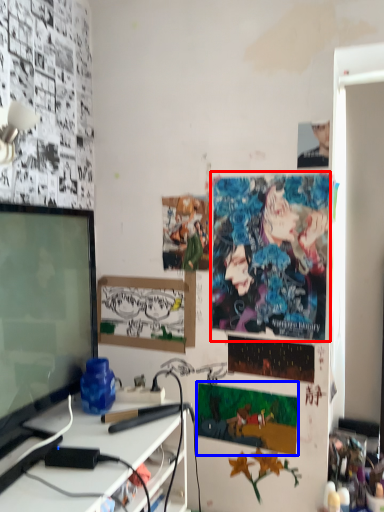
Question: Which object is closer to the camera taking this photo, poster page (highlighted by a red box) or poster page (highlighted by a blue box)?

Choices:
 (A) poster page
 (B) poster page

Answer: (A)